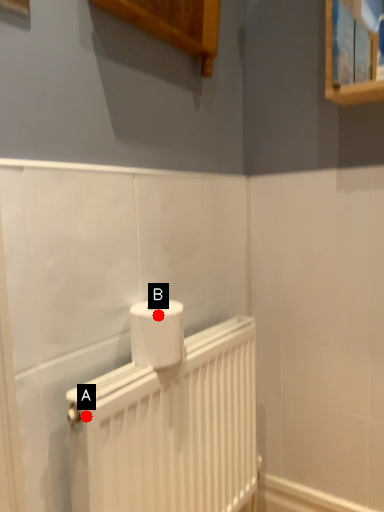
Question: Two points are circled on the image, labeled by A and B beside each circle. Which point is closer to the camera?

Choices:
 (A) A is closer
 (B) B is closer

Answer: (A)